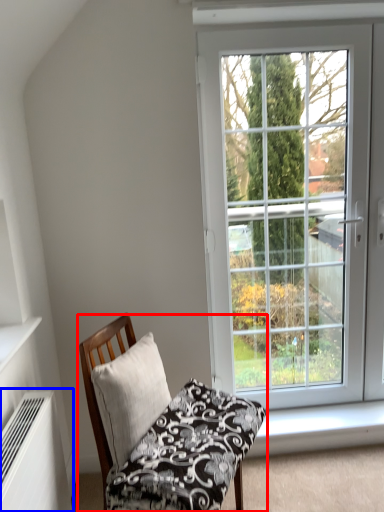
Question: Which object appears closest to the camera in this image, chair (highlighted by a red box) or air conditioner (highlighted by a blue box)?

Choices:
 (A) chair
 (B) air conditioner

Answer: (B)